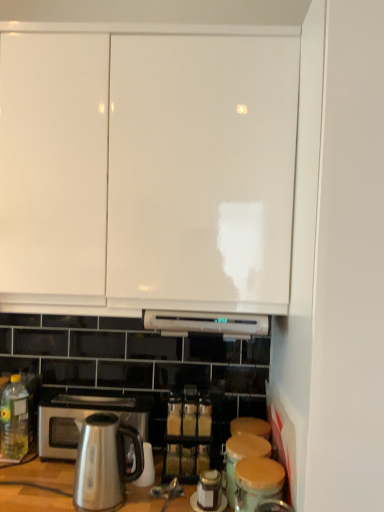
Find the location of a particular element. This screenshot has width=384, height=512. white glossy cabinet doors at upper center is located at coordinates (147, 170).

Measure the distance between matte brown canister at lower right, the 2th appliance from the back, and camera.

The distance of matte brown canister at lower right, the 2th appliance from the back, from camera is 3.41 feet.

What do you see at coordinates (187, 438) in the screenshot? Image resolution: width=384 pixels, height=512 pixels. I see `translucent glass spice jar at center` at bounding box center [187, 438].

The image size is (384, 512). I want to click on wooden lid canister at lower center, which appears as the second appliance when viewed from the front, so click(242, 456).

From a real-world perspective, is satin metallic kettle at lower left above or below yellow translucent bottle at lower left?

satin metallic kettle at lower left is situated lower than yellow translucent bottle at lower left in the real world.

I want to click on bottle behind the satin metallic kettle at lower left, so pyautogui.click(x=14, y=420).

Is satin metallic kettle at lower left situated inside yellow translucent bottle at lower left or outside?

satin metallic kettle at lower left lies outside yellow translucent bottle at lower left.

From the image's perspective, is satin metallic kettle at lower left located beneath yellow translucent bottle at lower left?

Yes, from the image's perspective, satin metallic kettle at lower left is beneath yellow translucent bottle at lower left.

Which of these two, satin silver microwave oven at lower left or wooden lid canister at lower center, which appears as the second appliance when viewed from the front, is bigger?

Bigger between the two is satin silver microwave oven at lower left.

Which of these two, satin silver microwave oven at lower left or wooden lid canister at lower center, which appears as the second appliance when viewed from the front, stands taller?

satin silver microwave oven at lower left is taller.

Is satin silver microwave oven at lower left oriented towards wooden lid canister at lower center, the first appliance when ordered from back to front?

No, satin silver microwave oven at lower left is not oriented towards wooden lid canister at lower center, the first appliance when ordered from back to front.

Looking at this image, is satin silver microwave oven at lower left completely or partially outside of wooden lid canister at lower center, which appears as the second appliance when viewed from the front?

That's correct, satin silver microwave oven at lower left is outside of wooden lid canister at lower center, which appears as the second appliance when viewed from the front.

Does point (109, 435) come behind point (246, 435)?

No, it is in front of (246, 435).

How much distance is there between satin metallic kettle at lower left and wooden lid canister at lower center, the first appliance when ordered from back to front?

A distance of 13.16 inches exists between satin metallic kettle at lower left and wooden lid canister at lower center, the first appliance when ordered from back to front.

Does satin metallic kettle at lower left have a lesser width compared to wooden lid canister at lower center, which appears as the second appliance when viewed from the front?

Incorrect, the width of satin metallic kettle at lower left is not less than that of wooden lid canister at lower center, which appears as the second appliance when viewed from the front.

Locate an element on the screen. kitchen appliance below the translucent glass spice jar at center (from a real-world perspective) is located at coordinates (104, 463).

Considering the points (185, 406) and (108, 424), which point is behind, point (185, 406) or point (108, 424)?

Positioned behind is point (185, 406).

Which of these two, translucent glass spice jar at center or satin metallic kettle at lower left, is thinner?

translucent glass spice jar at center.

Is translucent glass spice jar at center with satin metallic kettle at lower left?

translucent glass spice jar at center and satin metallic kettle at lower left are clearly separated.

Does yellow translucent bottle at lower left appear on the left side of translucent glass spice jar at center?

Yes, yellow translucent bottle at lower left is to the left of translucent glass spice jar at center.

Is yellow translucent bottle at lower left bigger than translucent glass spice jar at center?

Incorrect, yellow translucent bottle at lower left is not larger than translucent glass spice jar at center.

Is yellow translucent bottle at lower left spatially inside translucent glass spice jar at center, or outside of it?

yellow translucent bottle at lower left is not enclosed by translucent glass spice jar at center.

The width and height of the screenshot is (384, 512). Find the location of `bottle above the translucent glass spice jar at center (from the image's perspective)`. bottle above the translucent glass spice jar at center (from the image's perspective) is located at coordinates (14, 420).

Which point is more forward, (234, 484) or (16, 443)?

Positioned in front is point (234, 484).

Is wooden lid canister at lower center, the first appliance when ordered from back to front, taller or shorter than yellow translucent bottle at lower left?

Clearly, wooden lid canister at lower center, the first appliance when ordered from back to front, is shorter compared to yellow translucent bottle at lower left.

Considering the sizes of wooden lid canister at lower center, which appears as the second appliance when viewed from the front, and yellow translucent bottle at lower left in the image, is wooden lid canister at lower center, which appears as the second appliance when viewed from the front, bigger or smaller than yellow translucent bottle at lower left?

Considering their sizes, wooden lid canister at lower center, which appears as the second appliance when viewed from the front, takes up more space than yellow translucent bottle at lower left.

Looking at this image, is wooden lid canister at lower center, the first appliance when ordered from back to front, outside of yellow translucent bottle at lower left?

Yes, wooden lid canister at lower center, the first appliance when ordered from back to front, is located beyond the bounds of yellow translucent bottle at lower left.

Which point is more distant from viewer, (180, 403) or (231, 475)?

Positioned behind is point (180, 403).

Which object is closer to the camera taking this photo, translucent glass spice jar at center or wooden lid canister at lower center, which appears as the second appliance when viewed from the front?

wooden lid canister at lower center, which appears as the second appliance when viewed from the front, is closer to the camera.

From the image's perspective, relative to wooden lid canister at lower center, the first appliance when ordered from back to front, is translucent glass spice jar at center above or below?

From the image's perspective, translucent glass spice jar at center appears above wooden lid canister at lower center, the first appliance when ordered from back to front.

Identify the location of kitchen appliance that appears in front of the yellow translucent bottle at lower left. pos(104,463).

You are a GUI agent. You are given a task and a screenshot of the screen. Output one action in this format:
    pyautogui.click(x=<x>, y=<y>)
    Task: Click on the appliance that is the 2nd one below the satin silver microwave oven at lower left (from a real-world perspective)
    The width and height of the screenshot is (384, 512).
    Given the screenshot: What is the action you would take?
    pyautogui.click(x=242, y=456)

Estimate the real-world distances between objects in this image. Which object is further from satin metallic kettle at lower left, yellow translucent bottle at lower left or matte brown canister at lower right, the first appliance in the front-to-back sequence?

Among the two, yellow translucent bottle at lower left is located further to satin metallic kettle at lower left.

From the image, which object appears to be nearer to wooden lid canister at lower center, the first appliance when ordered from back to front, translucent glass spice jar at center or yellow translucent bottle at lower left?

The object closer to wooden lid canister at lower center, the first appliance when ordered from back to front, is translucent glass spice jar at center.

Looking at the image, which one is located further to satin silver microwave oven at lower left, matte brown canister at lower right, the first appliance in the front-to-back sequence, or satin metallic kettle at lower left?

Among the two, matte brown canister at lower right, the first appliance in the front-to-back sequence, is located further to satin silver microwave oven at lower left.

Looking at the image, which one is located further to satin silver microwave oven at lower left, white glossy cabinet doors at upper center or translucent glass spice jar at center?

The object further to satin silver microwave oven at lower left is white glossy cabinet doors at upper center.

Estimate the real-world distances between objects in this image. Which object is closer to satin metallic kettle at lower left, satin silver microwave oven at lower left or matte brown canister at lower right, the 2th appliance from the back?

satin silver microwave oven at lower left is closer to satin metallic kettle at lower left.

Based on their spatial positions, is translucent glass spice jar at center or yellow translucent bottle at lower left closer to satin metallic kettle at lower left?

Based on the image, translucent glass spice jar at center appears to be nearer to satin metallic kettle at lower left.

Estimate the real-world distances between objects in this image. Which object is closer to matte brown canister at lower right, the 2th appliance from the back, white glossy cabinet doors at upper center or wooden lid canister at lower center, which appears as the second appliance when viewed from the front?

Based on the image, wooden lid canister at lower center, which appears as the second appliance when viewed from the front, appears to be nearer to matte brown canister at lower right, the 2th appliance from the back.

Estimate the real-world distances between objects in this image. Which object is closer to satin metallic kettle at lower left, yellow translucent bottle at lower left or white glossy cabinet doors at upper center?

The object closer to satin metallic kettle at lower left is yellow translucent bottle at lower left.

The image size is (384, 512). In order to click on kitchen appliance between white glossy cabinet doors at upper center and matte brown canister at lower right, the first appliance in the front-to-back sequence, in the up-down direction in this screenshot , I will do `click(104, 463)`.

You are a GUI agent. You are given a task and a screenshot of the screen. Output one action in this format:
    pyautogui.click(x=<x>, y=<y>)
    Task: Click on the microwave oven between white glossy cabinet doors at upper center and matte brown canister at lower right, the first appliance in the front-to-back sequence, in the up-down direction
    
    Given the screenshot: What is the action you would take?
    pyautogui.click(x=82, y=419)

The height and width of the screenshot is (512, 384). What are the coordinates of `kitchen appliance between white glossy cabinet doors at upper center and satin silver microwave oven at lower left from top to bottom` in the screenshot? It's located at (104, 463).

At what (x,y) coordinates should I click in order to perform the action: click on kitchen appliance between white glossy cabinet doors at upper center and wooden lid canister at lower center, the first appliance when ordered from back to front, in the vertical direction. Please return your answer as a coordinate pair (x, y). The image size is (384, 512). Looking at the image, I should click on (104, 463).